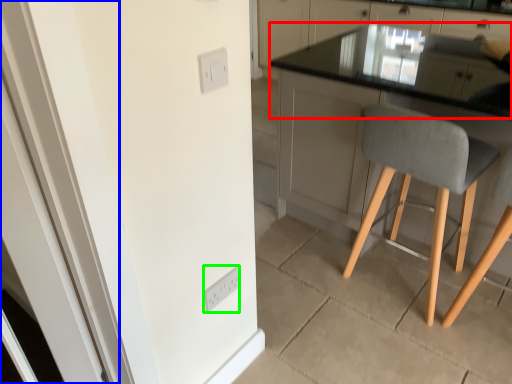
Question: Which object is positioned farthest from countertop (highlighted by a red box)? Select from screen door (highlighted by a blue box) and light switch (highlighted by a green box).

Choices:
 (A) screen door
 (B) light switch

Answer: (A)